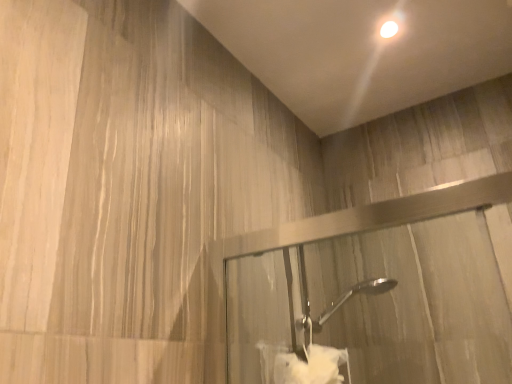
Question: Is white soft towel at lower center wider or thinner than white glossy droplight at upper center?

Choices:
 (A) thin
 (B) wide

Answer: (B)

Question: Choose the correct answer: Is white soft towel at lower center inside white glossy droplight at upper center or outside it?

Choices:
 (A) inside
 (B) outside

Answer: (B)

Question: Is white soft towel at lower center taller or shorter than white glossy droplight at upper center?

Choices:
 (A) short
 (B) tall

Answer: (B)

Question: Considering the positions of white glossy droplight at upper center and white soft towel at lower center in the image, is white glossy droplight at upper center bigger or smaller than white soft towel at lower center?

Choices:
 (A) small
 (B) big

Answer: (A)

Question: Looking at their shapes, would you say white glossy droplight at upper center is wider or thinner than white soft towel at lower center?

Choices:
 (A) thin
 (B) wide

Answer: (A)

Question: Is white glossy droplight at upper center taller or shorter than white soft towel at lower center?

Choices:
 (A) tall
 (B) short

Answer: (B)

Question: From a real-world perspective, is white glossy droplight at upper center above or below white soft towel at lower center?

Choices:
 (A) below
 (B) above

Answer: (B)